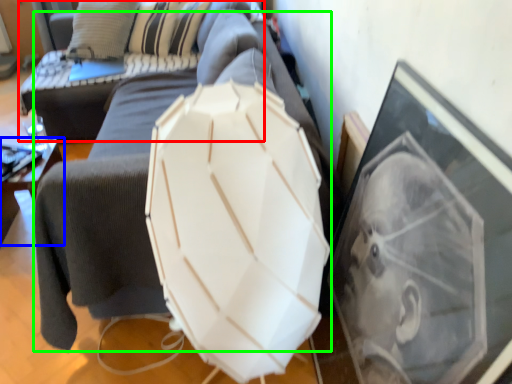
Question: Considering the real-world distances, which object is closest to couch (highlighted by a red box)? furniture (highlighted by a blue box) or swivel chair (highlighted by a green box).

Choices:
 (A) furniture
 (B) swivel chair

Answer: (A)